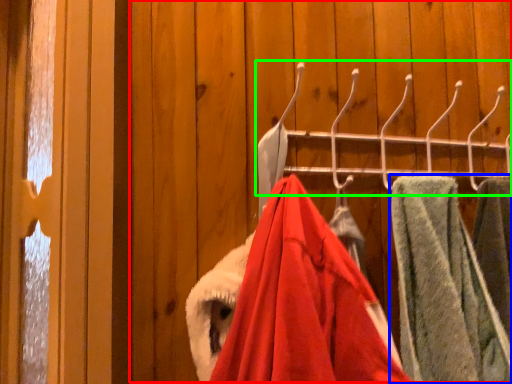
Question: Which object is positioned farthest from closet (highlighted by a red box)? Select from towel (highlighted by a blue box) and closet (highlighted by a green box).

Choices:
 (A) towel
 (B) closet

Answer: (A)